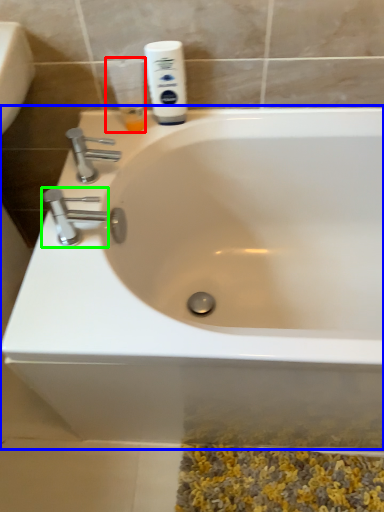
Question: Estimate the real-world distances between objects in this image. Which object is farther from mouthwash (highlighted by a red box), bathtub (highlighted by a blue box) or tap (highlighted by a green box)?

Choices:
 (A) bathtub
 (B) tap

Answer: (A)